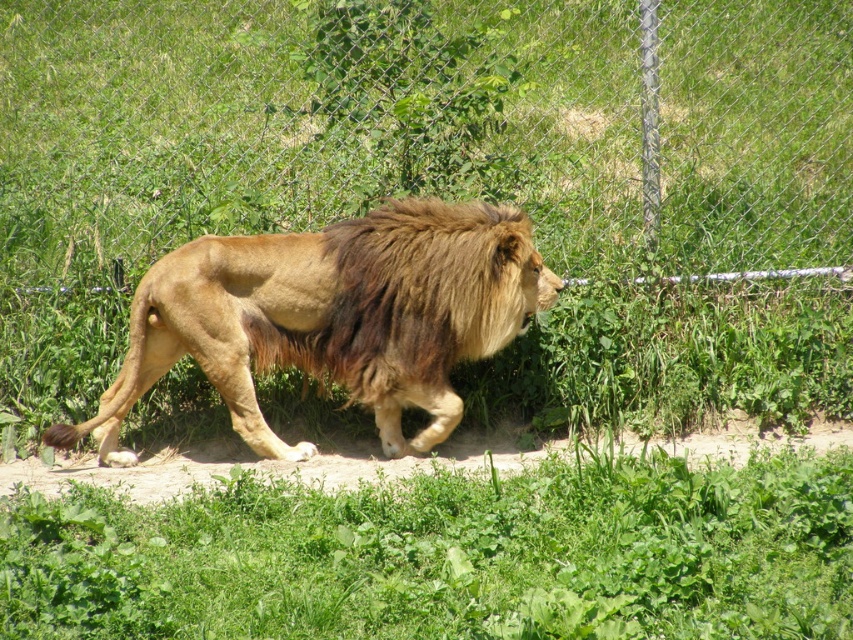
You are a zookeeper standing at the viewing area. You see the green leafy grass at lower center in the lion enclosure. Can you reach the grass with a 3.5 meter long pole?

The green leafy grass at lower center is 4.38 meters away from you, which is farther than the 3.5 meter pole. You cannot reach it with the pole.

Looking at this image, you are a zookeeper observing the lion enclosure. You notice the green leafy grass at lower center and the brown fuzzy mane at center. Which object is closer to you from your viewpoint?

The green leafy grass at lower center is closer to you because it is positioned in front of the brown fuzzy mane at center.